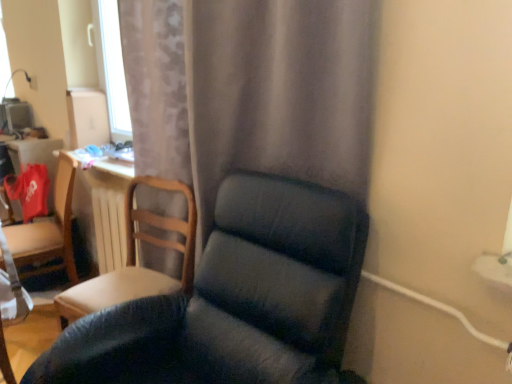
Question: Is white wooden radiator at center positioned with its back to matte gray curtain at center?

Choices:
 (A) no
 (B) yes

Answer: (A)

Question: From a real-world perspective, is white wooden radiator at center located beneath matte gray curtain at center?

Choices:
 (A) no
 (B) yes

Answer: (B)

Question: Is white wooden radiator at center facing towards matte gray curtain at center?

Choices:
 (A) no
 (B) yes

Answer: (A)

Question: Is white wooden radiator at center far away from matte gray curtain at center?

Choices:
 (A) no
 (B) yes

Answer: (A)

Question: Is white wooden radiator at center thinner than matte gray curtain at center?

Choices:
 (A) yes
 (B) no

Answer: (A)

Question: Is point (140, 223) positioned closer to the camera than point (30, 251)?

Choices:
 (A) farther
 (B) closer

Answer: (B)

Question: Would you say wooden chair at left, which is the 2th chair from left to right, is inside or outside matte wooden chair at left, positioned as the third chair in right-to-left order?

Choices:
 (A) outside
 (B) inside

Answer: (A)

Question: In terms of height, does wooden chair at left, which is counted as the 2th chair, starting from the right, look taller or shorter compared to matte wooden chair at left, positioned as the third chair in right-to-left order?

Choices:
 (A) short
 (B) tall

Answer: (B)

Question: Looking at their shapes, would you say wooden chair at left, arranged as the second chair when viewed from the back, is wider or thinner than matte wooden chair at left, which appears as the first chair when viewed from the left?

Choices:
 (A) thin
 (B) wide

Answer: (B)

Question: Based on their sizes in the image, would you say white wooden radiator at center is bigger or smaller than matte wooden chair at left, the third chair in the front-to-back sequence?

Choices:
 (A) big
 (B) small

Answer: (B)

Question: Is white wooden radiator at center in front of or behind matte wooden chair at left, positioned as the third chair in right-to-left order, in the image?

Choices:
 (A) front
 (B) behind

Answer: (A)

Question: From their relative heights in the image, would you say white wooden radiator at center is taller or shorter than matte wooden chair at left, positioned as the third chair in right-to-left order?

Choices:
 (A) short
 (B) tall

Answer: (B)

Question: Considering the positions of point (105, 253) and point (66, 228), is point (105, 253) closer or farther from the camera than point (66, 228)?

Choices:
 (A) farther
 (B) closer

Answer: (A)

Question: Considering the positions of wooden chair at left, which is the 2th chair from left to right, and matte gray curtain at center in the image, is wooden chair at left, which is the 2th chair from left to right, wider or thinner than matte gray curtain at center?

Choices:
 (A) wide
 (B) thin

Answer: (A)

Question: Visually, is wooden chair at left, arranged as the second chair when viewed from the front, positioned to the left or to the right of matte gray curtain at center?

Choices:
 (A) left
 (B) right

Answer: (A)